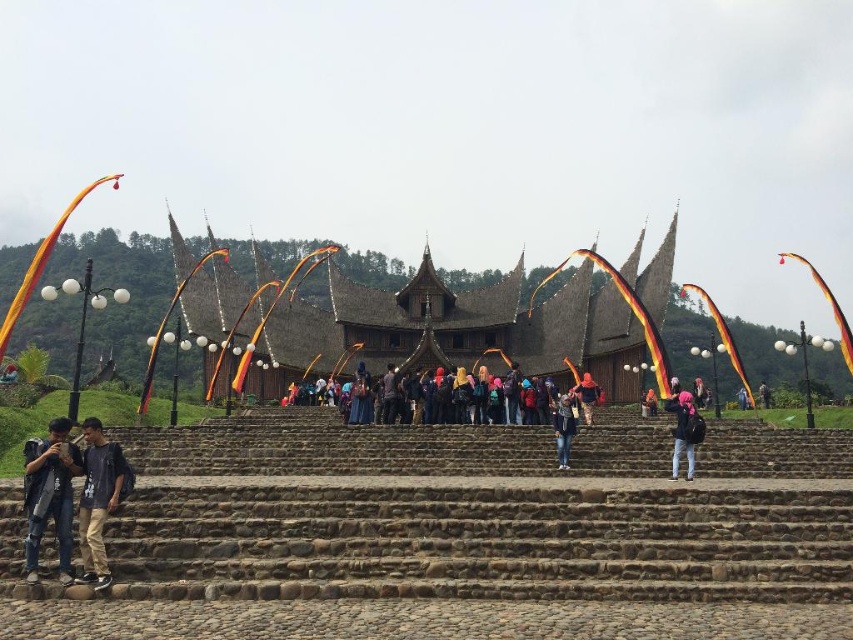
Question: Among these objects, which one is farthest from the camera?

Choices:
 (A) pink fabric backpack at lower right
 (B) dark gray fabric pants at lower left
 (C) denim jacket at lower left

Answer: (A)

Question: Where is matte orange headscarf at center located in relation to camouflage jacket at center in the image?

Choices:
 (A) above
 (B) below

Answer: (A)

Question: Is pink fabric backpack at lower right below matte orange headscarf at center?

Choices:
 (A) no
 (B) yes

Answer: (B)

Question: Which of these objects is positioned farthest from the brown stone stairs at center?

Choices:
 (A) dark blue jeans at center
 (B) dark gray fabric pants at lower left
 (C) brown thatched roof at center

Answer: (C)

Question: Which is nearer to the brown stone stairs at center?

Choices:
 (A) matte orange headscarf at center
 (B) dark blue jeans at center
 (C) pink fabric backpack at lower right

Answer: (B)

Question: Observing the image, what is the correct spatial positioning of dark gray fabric pants at lower left in reference to matte orange headscarf at center?

Choices:
 (A) above
 (B) below

Answer: (B)